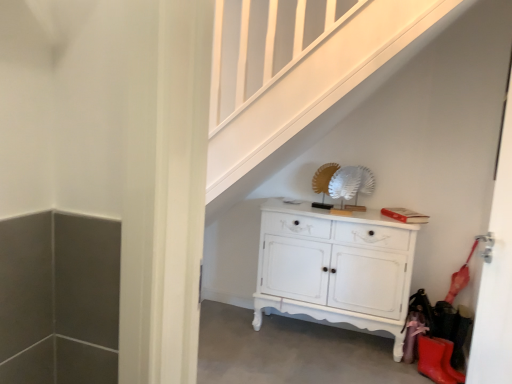
I want to click on white glossy door at right, so click(x=496, y=275).

What is the approximate height of rubber matte boot at lower right?

rubber matte boot at lower right is 8.78 inches in height.

The width and height of the screenshot is (512, 384). Find the location of `white glossy door at right`. white glossy door at right is located at coordinates (496, 275).

What's the angular difference between white painted wood cabinet at center and white glossy door at right's facing directions?

The angular difference between white painted wood cabinet at center and white glossy door at right is 82.7 degrees.

Looking at this image, based on their positions, is white painted wood cabinet at center located to the left or right of white glossy door at right?

Clearly, white painted wood cabinet at center is on the left of white glossy door at right in the image.

Based on their sizes in the image, would you say white painted wood cabinet at center is bigger or smaller than white glossy door at right?

white painted wood cabinet at center is bigger than white glossy door at right.

Where is `door on the right of the white painted wood cabinet at center`? Image resolution: width=512 pixels, height=384 pixels. door on the right of the white painted wood cabinet at center is located at coordinates (496, 275).

Could white painted wood cabinet at center be considered to be inside white glossy door at right?

No, white glossy door at right does not contain white painted wood cabinet at center.

Does white glossy door at right appear on the right side of white painted wood cabinet at center?

Yes.

Which object is thinner, white glossy door at right or white painted wood cabinet at center?

white glossy door at right is thinner.

Which object is thinner, rubber matte boot at lower right or white painted wood cabinet at center?

With smaller width is rubber matte boot at lower right.

Is rubber matte boot at lower right inside the boundaries of white painted wood cabinet at center, or outside?

rubber matte boot at lower right is not enclosed by white painted wood cabinet at center.

Is white painted wood cabinet at center at the back of rubber matte boot at lower right?

Yes, rubber matte boot at lower right's orientation is away from white painted wood cabinet at center.

Consider the image. Is rubber matte boot at lower right bigger than white glossy door at right?

No, rubber matte boot at lower right is not bigger than white glossy door at right.

Could you tell me if rubber matte boot at lower right is turned towards white glossy door at right?

No.

Is there a large distance between rubber matte boot at lower right and white glossy door at right?

Absolutely, rubber matte boot at lower right is distant from white glossy door at right.

Is rubber matte boot at lower right inside or outside of white glossy door at right?

rubber matte boot at lower right exists outside the volume of white glossy door at right.

Which of these two, white painted wood cabinet at center or rubber matte boot at lower right, is wider?

With larger width is white painted wood cabinet at center.

Is white painted wood cabinet at center turned away from rubber matte boot at lower right?

white painted wood cabinet at center is not turned away from rubber matte boot at lower right.

Is white painted wood cabinet at center inside or outside of rubber matte boot at lower right?

white painted wood cabinet at center lies outside rubber matte boot at lower right.

Consider the image. How different are the orientations of white painted wood cabinet at center and rubber matte boot at lower right in degrees?

They differ by 54.4 degrees in their facing directions.

From a real-world perspective, is white glossy door at right positioned above or below rubber matte boot at lower right?

white glossy door at right is above rubber matte boot at lower right.

Between point (511, 331) and point (429, 362), which one is positioned behind?

Positioned behind is point (429, 362).

Is white glossy door at right bigger than rubber matte boot at lower right?

Indeed, white glossy door at right has a larger size compared to rubber matte boot at lower right.

Considering the relative positions of white glossy door at right and rubber matte boot at lower right in the image provided, is white glossy door at right in front of rubber matte boot at lower right?

Yes, the depth of white glossy door at right is less than that of rubber matte boot at lower right.

In order to click on door on the right of white painted wood cabinet at center in this screenshot , I will do `click(496, 275)`.

This screenshot has width=512, height=384. In order to click on the chest of drawers behind the white glossy door at right in this screenshot , I will do `click(335, 267)`.

Considering their positions, is white glossy door at right positioned further to white painted wood cabinet at center than rubber matte boot at lower right?

white glossy door at right is positioned further to the anchor white painted wood cabinet at center.

When comparing their distances from rubber matte boot at lower right, does white painted wood cabinet at center or white glossy door at right seem closer?

Among the two, white painted wood cabinet at center is located nearer to rubber matte boot at lower right.

Considering their positions, is white painted wood cabinet at center positioned closer to white glossy door at right than rubber matte boot at lower right?

white painted wood cabinet at center is closer to white glossy door at right.

Based on their spatial positions, is white glossy door at right or white painted wood cabinet at center closer to rubber matte boot at lower right?

white painted wood cabinet at center is positioned closer to the anchor rubber matte boot at lower right.

Which object lies further to the anchor point white painted wood cabinet at center, rubber matte boot at lower right or white glossy door at right?

Among the two, white glossy door at right is located further to white painted wood cabinet at center.

From the image, which object appears to be nearer to white glossy door at right, rubber matte boot at lower right or white painted wood cabinet at center?

white painted wood cabinet at center.

This screenshot has width=512, height=384. Identify the location of shoe located between white glossy door at right and white painted wood cabinet at center in the depth direction. (432, 360).